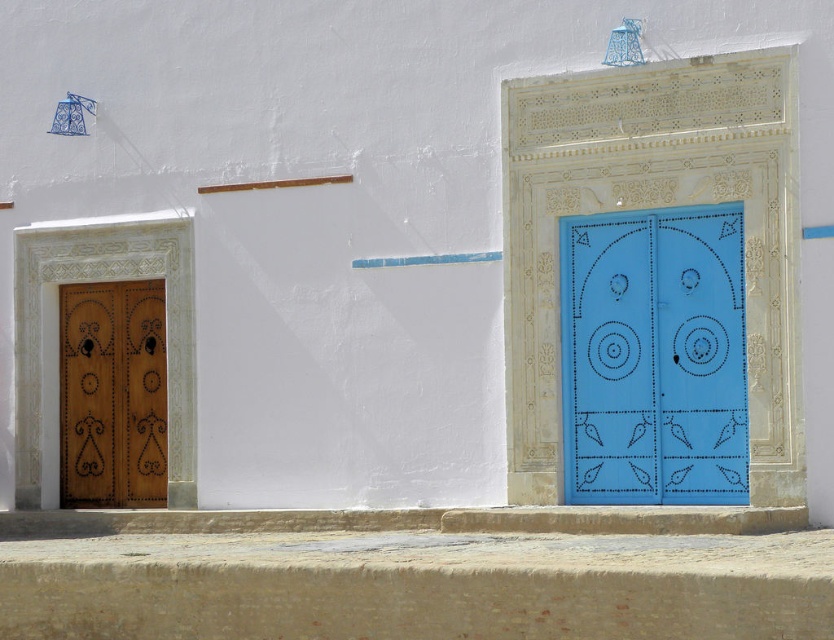
Question: Which object is closer to the camera taking this photo?

Choices:
 (A) blue painted wood door at right
 (B) wooden door at left

Answer: (A)

Question: Can you confirm if blue painted wood door at right is positioned to the left of wooden door at left?

Choices:
 (A) no
 (B) yes

Answer: (A)

Question: Can you confirm if blue painted wood door at right is positioned to the left of wooden door at left?

Choices:
 (A) no
 (B) yes

Answer: (A)

Question: From the image, what is the correct spatial relationship of blue painted wood door at right in relation to wooden door at left?

Choices:
 (A) above
 (B) below

Answer: (A)

Question: Among these points, which one is nearest to the camera?

Choices:
 (A) (94, 433)
 (B) (730, 314)

Answer: (B)

Question: Which object is closer to the camera taking this photo?

Choices:
 (A) blue painted wood door at right
 (B) wooden door at left

Answer: (A)